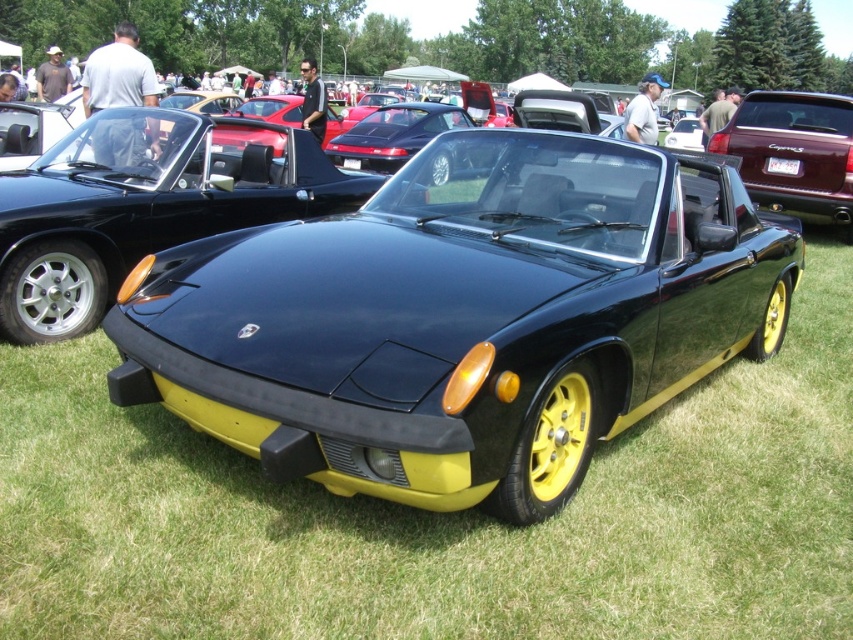
Is the position of shiny black convertible at center more distant than that of matte black convertible at upper right?

That is False.

Is shiny black convertible at center above matte black convertible at upper right?

Incorrect, shiny black convertible at center is not positioned above matte black convertible at upper right.

Between point (25, 243) and point (833, 164), which one is positioned behind?

The point (833, 164) is behind.

I want to click on shiny black convertible at center, so click(144, 205).